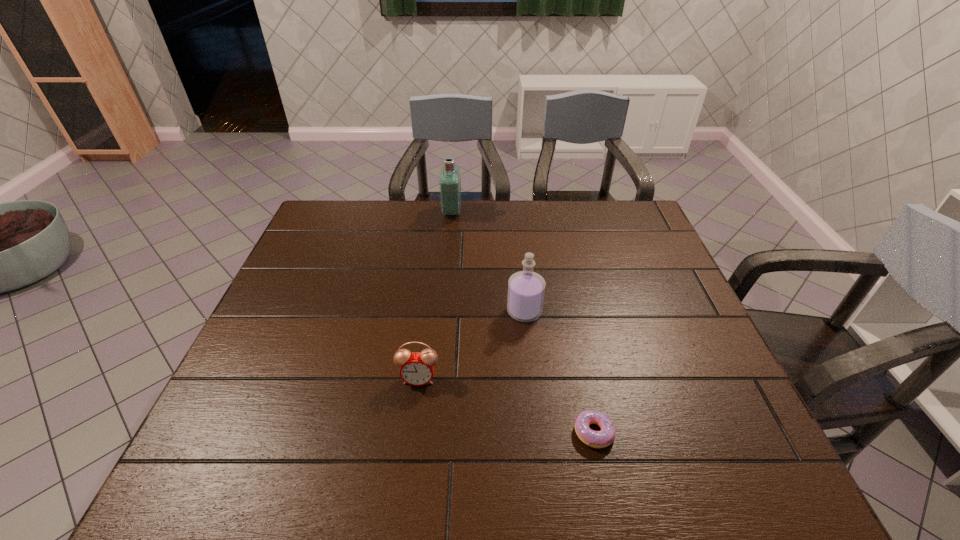
In order to click on free space located 0.160m on the clock face of the alarm clock in this screenshot , I will do `click(409, 455)`.

At what (x,y) coordinates should I click in order to perform the action: click on free space located 0.340m on the left of the rightmost object. Please return your answer as a coordinate pair (x, y). The image size is (960, 540). Looking at the image, I should click on (409, 433).

The image size is (960, 540). What are the coordinates of `object present at the far edge` in the screenshot? It's located at (450, 180).

The image size is (960, 540). Find the location of `object present at the near edge`. object present at the near edge is located at coordinates (597, 439).

At what (x,y) coordinates should I click in order to perform the action: click on vacant space at the far edge of the desktop. Please return your answer as a coordinate pair (x, y). Looking at the image, I should click on (529, 226).

Identify the location of vacant space at the left edge of the desktop. (295, 330).

Where is `free space at the right edge of the desktop`? free space at the right edge of the desktop is located at coordinates (619, 268).

At what (x,y) coordinates should I click in order to perform the action: click on blank area at the far left corner. Please return your answer as a coordinate pair (x, y). The image size is (960, 540). Looking at the image, I should click on (362, 208).

Where is `vacant region at the far right corner of the desktop`? The width and height of the screenshot is (960, 540). vacant region at the far right corner of the desktop is located at coordinates (606, 223).

Locate an element on the screen. vacant point located between the left perfume and the third farthest object is located at coordinates (435, 295).